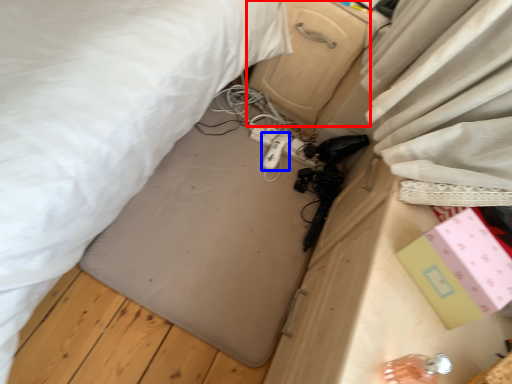
Question: Which object appears closest to the camera in this image, drawer (highlighted by a red box) or equipment (highlighted by a blue box)?

Choices:
 (A) drawer
 (B) equipment

Answer: (A)